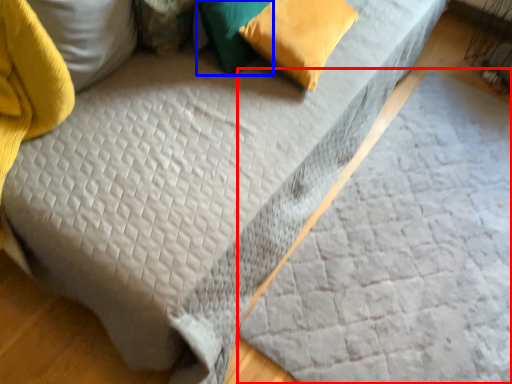
Question: Which object is closer to the camera taking this photo, sheet (highlighted by a red box) or pillow (highlighted by a blue box)?

Choices:
 (A) sheet
 (B) pillow

Answer: (A)